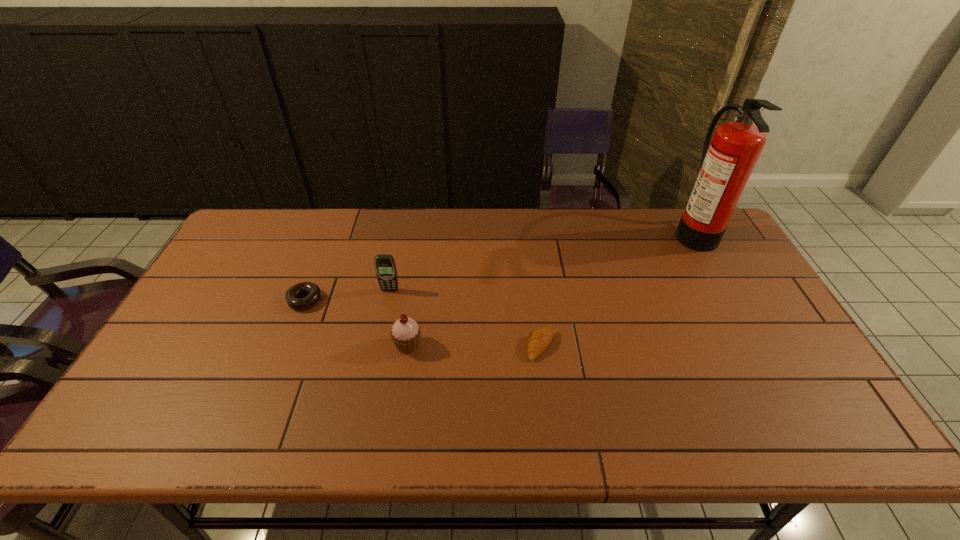
Find the location of a particular element. Image resolution: width=960 pixels, height=540 pixels. blank space located 0.200m on the screen of the cellular telephone is located at coordinates (378, 346).

Find the location of a particular element. The width and height of the screenshot is (960, 540). vacant position located 0.130m on the back of the third tallest object is located at coordinates (415, 299).

Locate an element on the screen. The width and height of the screenshot is (960, 540). free space located 0.290m on the right of the crescent roll is located at coordinates (668, 346).

At what (x,y) coordinates should I click in order to perform the action: click on vacant space located on the back of the doughnut. Please return your answer as a coordinate pair (x, y). The height and width of the screenshot is (540, 960). Looking at the image, I should click on (334, 225).

Identify the location of object located in the far edge section of the desktop. The width and height of the screenshot is (960, 540). (727, 162).

I want to click on object present at the right edge, so click(727, 162).

At what (x,y) coordinates should I click in order to perform the action: click on object at the far right corner. Please return your answer as a coordinate pair (x, y). This screenshot has height=540, width=960. Looking at the image, I should click on (727, 162).

In the image, there is a desktop. Identify the location of vacant space at the far edge. The height and width of the screenshot is (540, 960). (442, 241).

At what (x,y) coordinates should I click in order to perform the action: click on free space at the near edge. Please return your answer as a coordinate pair (x, y). The height and width of the screenshot is (540, 960). Looking at the image, I should click on (658, 438).

Identify the location of vacant area at the left edge. (144, 385).